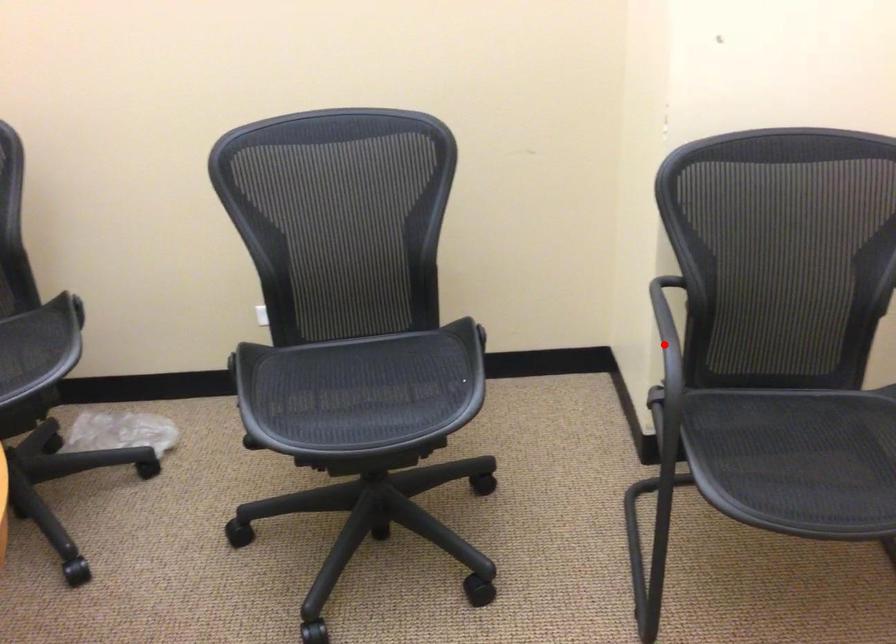
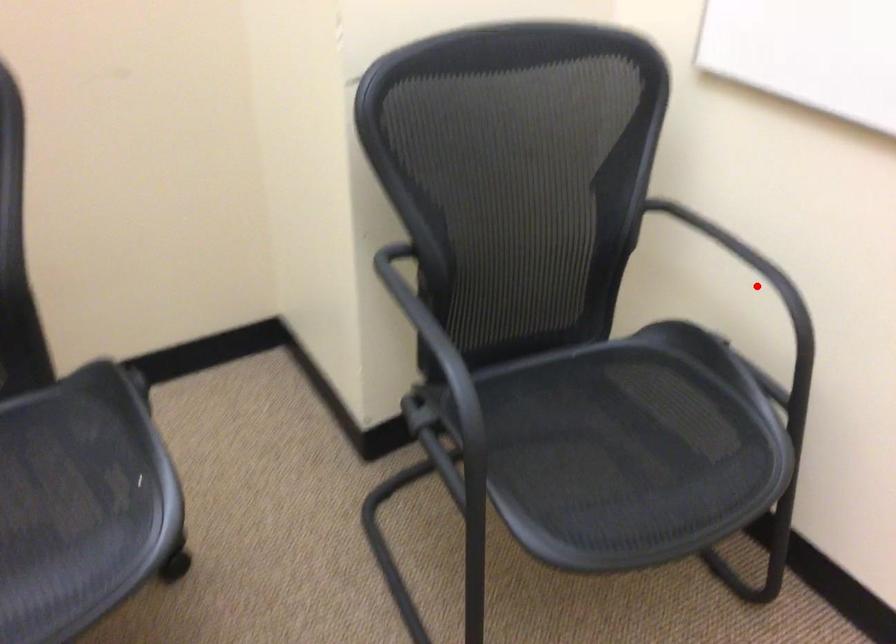
I am providing you with two images of the same scene from different viewpoints. A red point is marked on the first image and another point is marked on the second image. Does the point marked in image1 correspond to the same location as the one in image2?

No